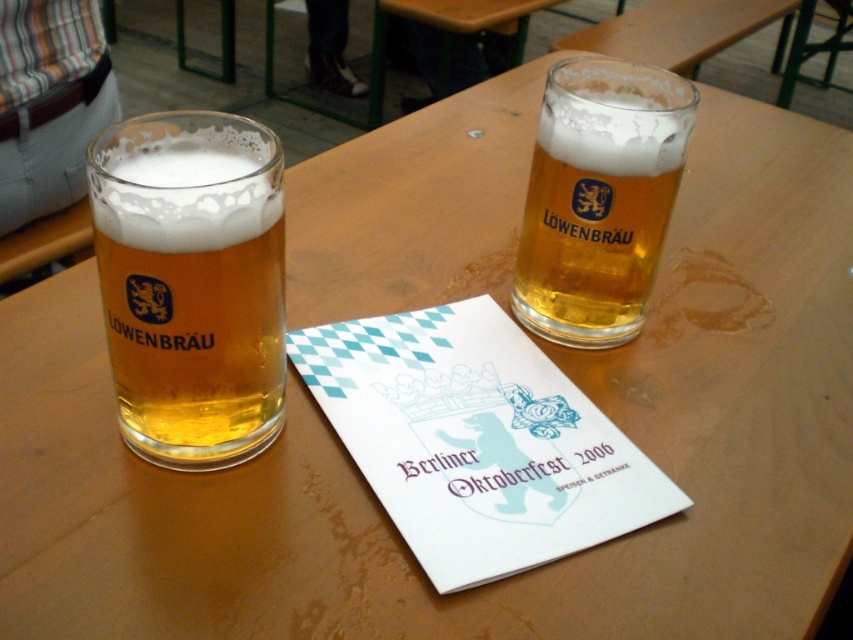
You are at a pub and want to grab the golden glass beer at upper right. Which direction should you move your hand relative to the translucent glass mug at left to reach it?

To reach the golden glass beer at upper right, move your hand to the right from the translucent glass mug at left since it is positioned to its right side.

You are setting up a table for a party and need to arrange two L?WENBR?U beer glasses. The translucent glass mug at left is narrower than the golden glass beer at upper right. Which glass should you place in the center of the table if you want the wider glass to be on the right side?

You should place the golden glass beer at upper right on the right side of the table since it is wider than the translucent glass mug at left.

You are a photographer trying to capture a closeup of the napkin between the two L?WENBR?U beer glasses. Which of the two points, point (270, 205) or point (537, 280), is better to focus on to ensure the napkin is in sharp focus?

Point (270, 205) is closer to the camera than point (537, 280), so focusing on point (270, 205) will ensure the napkin is in sharp focus.